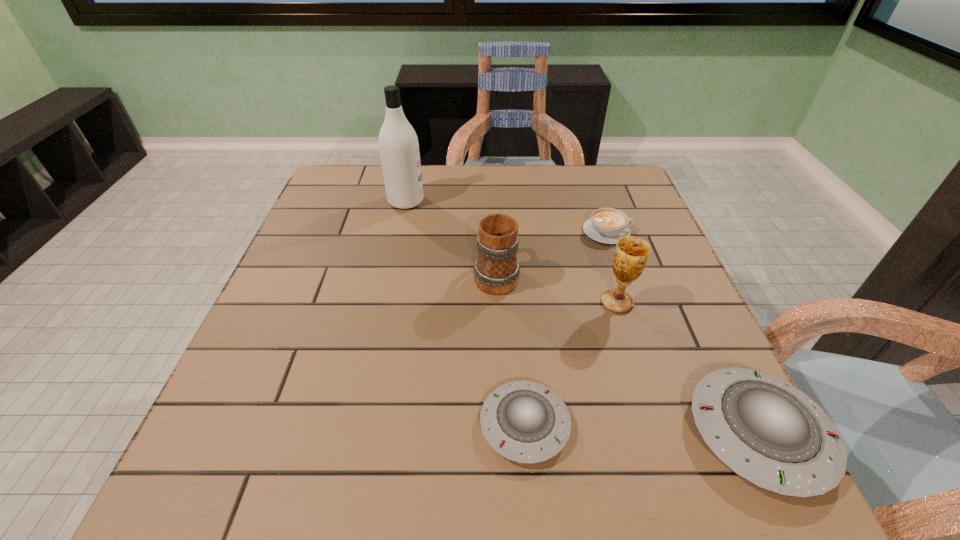
At what (x,y) coordinates should I click in order to perform the action: click on free spot that satisfies the following two spatial constraints: 1. on the front side of the left saucer; 2. on the right side of the taller saucer. Please return your answer as a coordinate pair (x, y). Image resolution: width=960 pixels, height=540 pixels. Looking at the image, I should click on (525, 433).

This screenshot has width=960, height=540. What are the coordinates of `blank area in the image that satisfies the following two spatial constraints: 1. on the front-facing side of the tallest object; 2. on the back side of the left saucer` in the screenshot? It's located at (357, 424).

Identify the location of free space that satisfies the following two spatial constraints: 1. on the front-facing side of the leftmost object; 2. on the left side of the chalice. (384, 302).

This screenshot has height=540, width=960. Find the location of `free spot that satisfies the following two spatial constraints: 1. on the front-facing side of the tallest object; 2. on the back side of the chalice`. free spot that satisfies the following two spatial constraints: 1. on the front-facing side of the tallest object; 2. on the back side of the chalice is located at coordinates (384, 302).